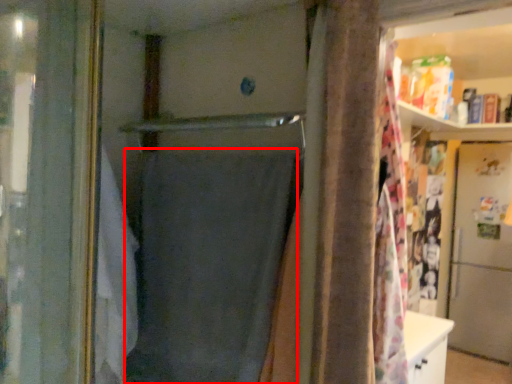
Question: From the image's perspective, considering the relative positions of shower curtain (annotated by the red box) and screen door in the image provided, where is shower curtain (annotated by the red box) located with respect to the staircase?

Choices:
 (A) below
 (B) above

Answer: (B)